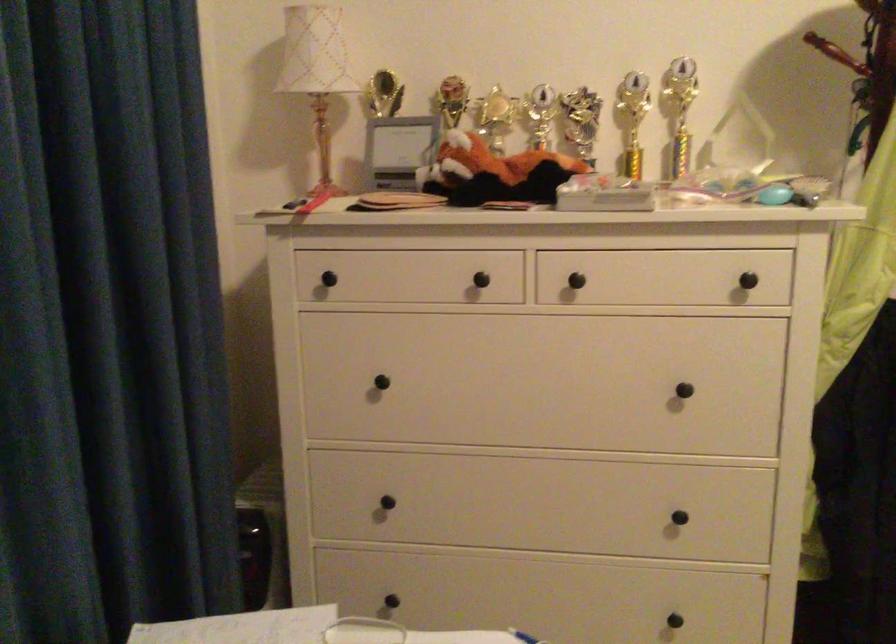
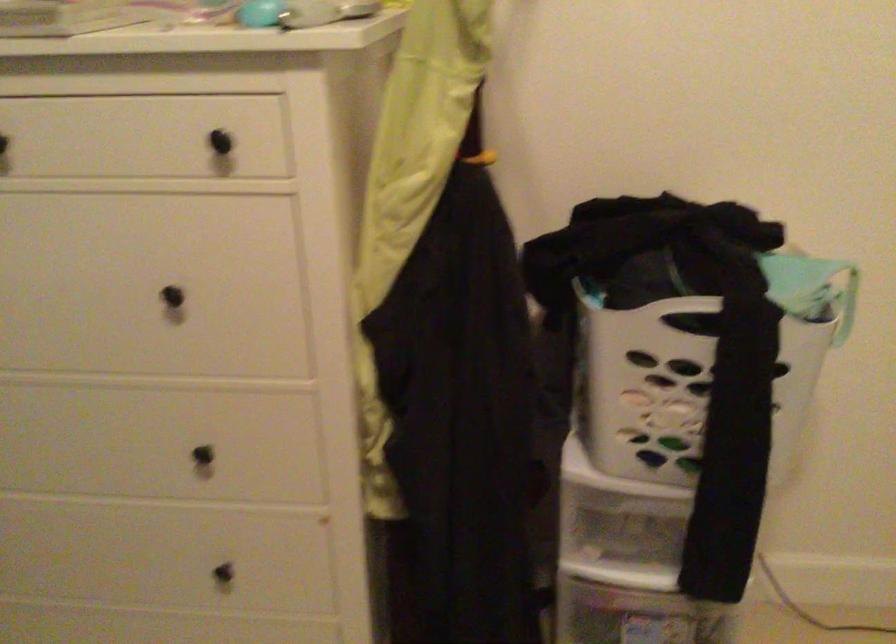
The point at (x=682, y=399) is marked in the first image. Where is the corresponding point in the second image?

(178, 305)